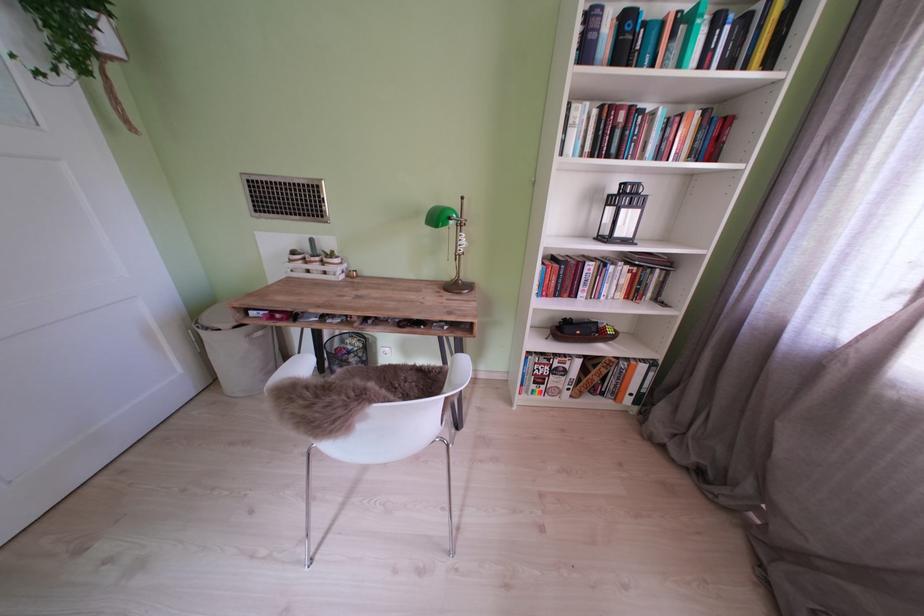
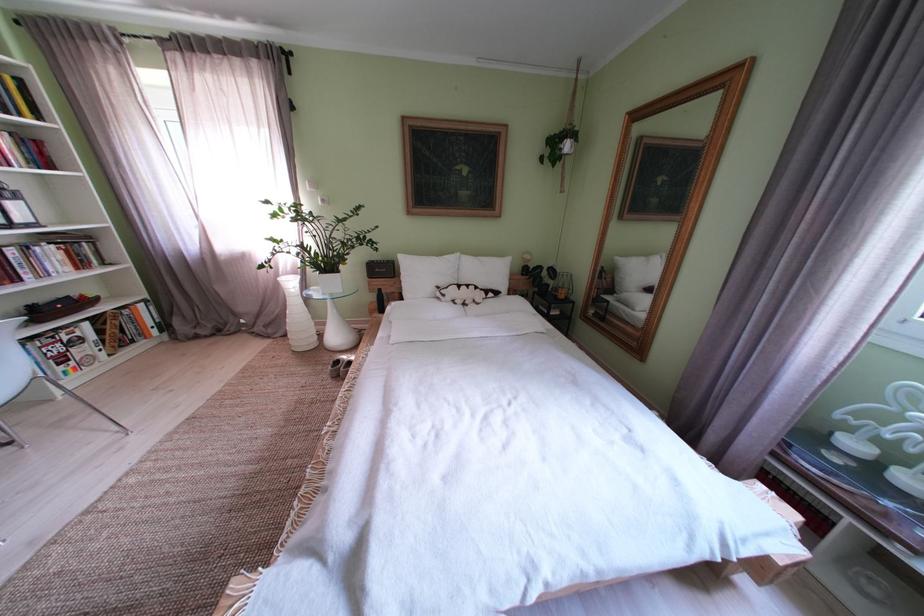
Locate, in the second image, the point that corresponds to pixel 763 31 in the first image.

(9, 92)